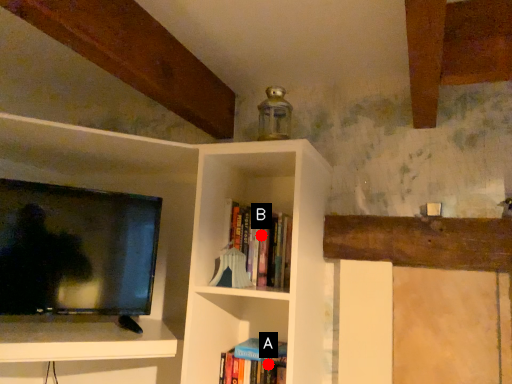
Question: Two points are circled on the image, labeled by A and B beside each circle. Which point is closer to the camera taking this photo?

Choices:
 (A) A is closer
 (B) B is closer

Answer: (A)